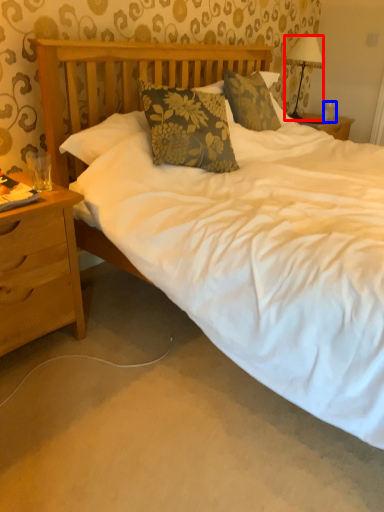
Question: Which object is further to the camera taking this photo, lamp (highlighted by a red box) or coffee cup (highlighted by a blue box)?

Choices:
 (A) lamp
 (B) coffee cup

Answer: (B)